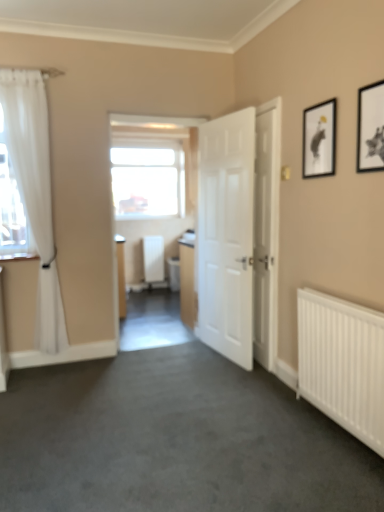
Question: From a real-world perspective, is white matte door at center, marked as the second door in a right-to-left arrangement, physically above black matte picture frame at upper right, marked as the 1th picture frame in a right-to-left arrangement?

Choices:
 (A) yes
 (B) no

Answer: (B)

Question: Would you say white matte door at center, marked as the second door in a right-to-left arrangement, is outside black matte picture frame at upper right, the second picture frame positioned from the back?

Choices:
 (A) no
 (B) yes

Answer: (B)

Question: Is white matte door at center, which is the first door from left to right, to the right of black matte picture frame at upper right, which is the 1th picture frame in front-to-back order, from the viewer's perspective?

Choices:
 (A) no
 (B) yes

Answer: (A)

Question: Considering the relative sizes of white matte door at center, marked as the second door in a right-to-left arrangement, and black matte picture frame at upper right, which is the 1th picture frame in front-to-back order, in the image provided, is white matte door at center, marked as the second door in a right-to-left arrangement, smaller than black matte picture frame at upper right, which is the 1th picture frame in front-to-back order,?

Choices:
 (A) yes
 (B) no

Answer: (B)

Question: Is white matte door at center, marked as the second door in a right-to-left arrangement, far from black matte picture frame at upper right, marked as the second picture frame in a left-to-right arrangement?

Choices:
 (A) no
 (B) yes

Answer: (B)

Question: From the image's perspective, is white matte door at center, marked as the second door in a right-to-left arrangement, below black matte picture frame at upper right, which is the 1th picture frame in front-to-back order?

Choices:
 (A) no
 (B) yes

Answer: (B)

Question: Does transparent glass window at center have a lesser width compared to white matte door at center, which is the first door from left to right?

Choices:
 (A) no
 (B) yes

Answer: (B)

Question: Is transparent glass window at center positioned far away from white matte door at center, marked as the second door in a right-to-left arrangement?

Choices:
 (A) yes
 (B) no

Answer: (B)

Question: Would you say transparent glass window at center is outside white matte door at center, marked as the second door in a right-to-left arrangement?

Choices:
 (A) yes
 (B) no

Answer: (A)

Question: Is transparent glass window at center placed right next to white matte door at center, marked as the second door in a right-to-left arrangement?

Choices:
 (A) no
 (B) yes

Answer: (A)

Question: Is transparent glass window at center further to the viewer compared to white matte door at center, marked as the second door in a right-to-left arrangement?

Choices:
 (A) no
 (B) yes

Answer: (B)

Question: Can you confirm if transparent glass window at center is bigger than white matte door at center, which is the first door from left to right?

Choices:
 (A) yes
 (B) no

Answer: (B)

Question: Is transparent glass window at center further to the viewer compared to white wooden door at right, which is the 2th door from left to right?

Choices:
 (A) no
 (B) yes

Answer: (B)